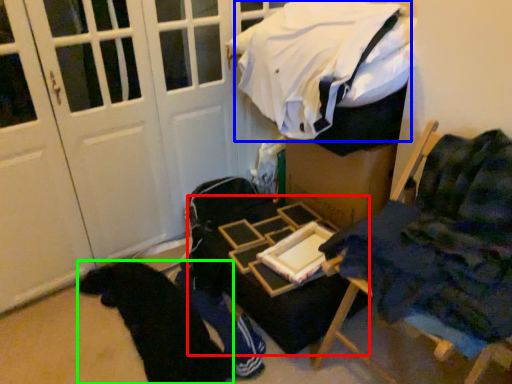
Question: Considering the real-world distances, which object is farthest from table (highlighted by a red box)? laundry (highlighted by a blue box) or clothing (highlighted by a green box)?

Choices:
 (A) laundry
 (B) clothing

Answer: (A)